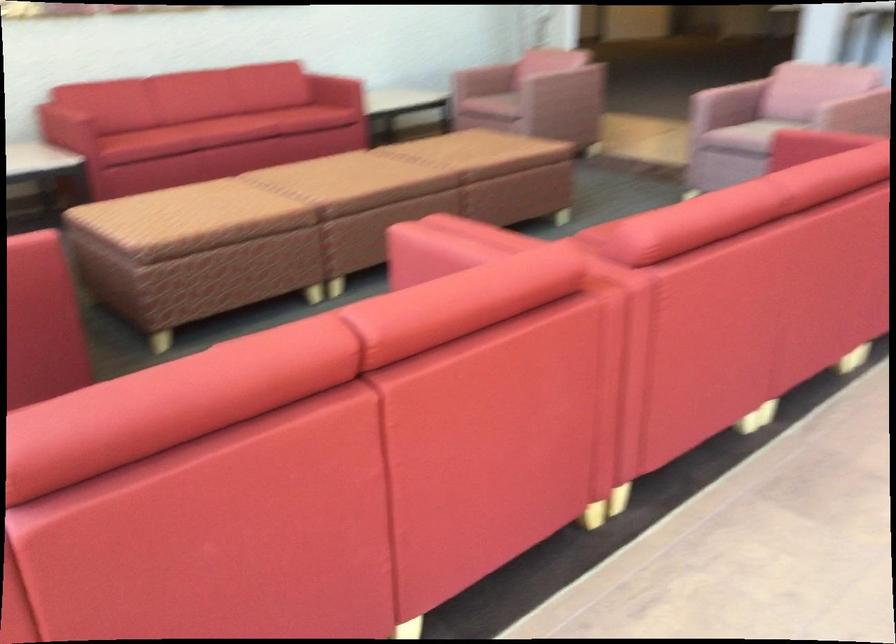
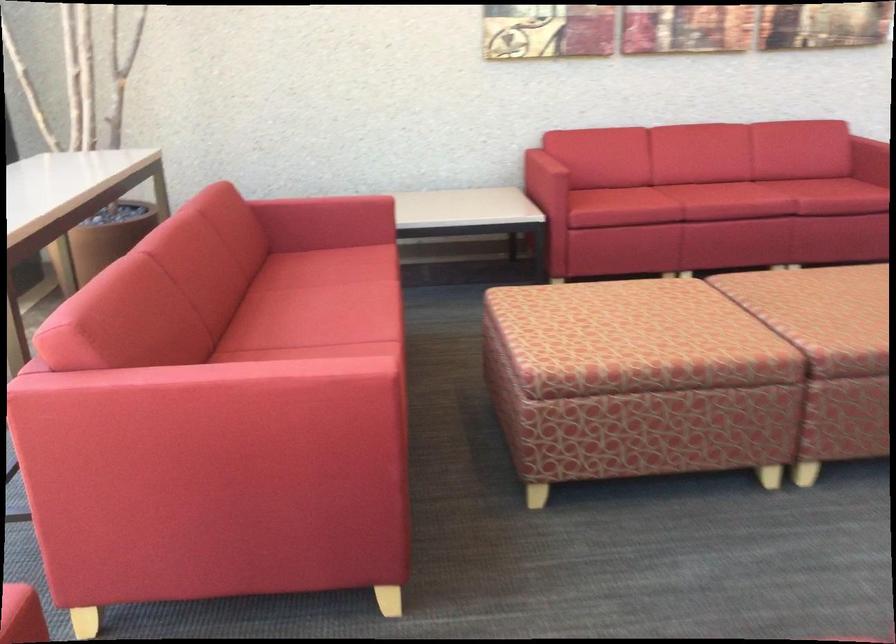
Locate, in the second image, the point that corresponds to pixel 332 183 in the first image.

(834, 317)